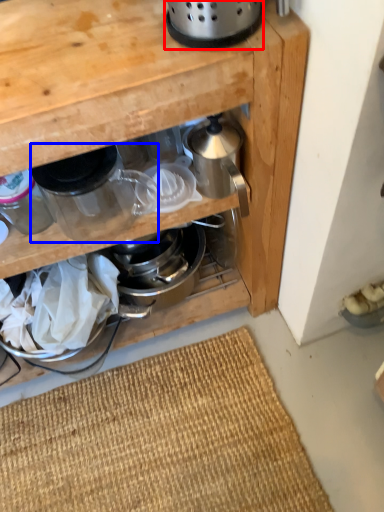
Question: Among these objects, which one is farthest to the camera, appliance (highlighted by a red box) or kitchen appliance (highlighted by a blue box)?

Choices:
 (A) appliance
 (B) kitchen appliance

Answer: (B)